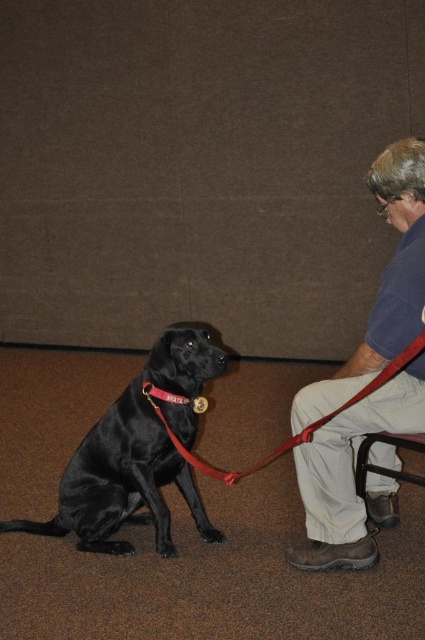
You are a photographer setting up a shot of the scene. You want to ensure that both the blue cotton shirt at right and the metallic gold dog collar at center are clearly visible in the frame. Based on their positions, which object is closer to the camera?

The blue cotton shirt at right is positioned over the metallic gold dog collar at center, meaning it is closer to the camera.

You are a photographer setting up a shot in this room. You need to ensure that the blue cotton shirt at right and the shiny black dog at center are both in frame. Given their sizes, which object should you adjust the camera angle to focus on first to accommodate both?

The blue cotton shirt at right is narrower than the shiny black dog at center, so you should focus on positioning the dog first since it takes up more space, then adjust the angle to include the shirt.

You are a photographer standing 6 feet away from the shiny black dog at center. You want to take a clear photo of the dog without moving your position. Can you do it?

The shiny black dog at center and camera are 6.66 feet apart, so since you are standing 6 feet away, you are slightly closer than the required distance. Therefore, you cannot take a clear photo without moving closer or adjusting your equipment.